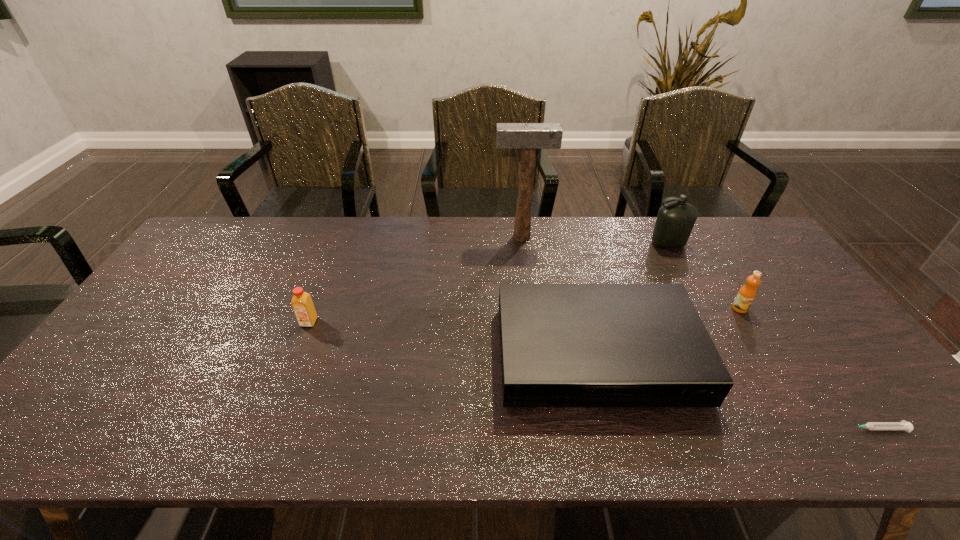
The width and height of the screenshot is (960, 540). Identify the location of vacant space that's between the bottle and the nearer orange juice. (489, 283).

Find the location of `free space between the fourth object from left to right and the farther orange juice`. free space between the fourth object from left to right and the farther orange juice is located at coordinates (704, 276).

Find the location of `vacant space in between the right orange juice and the second tallest object`. vacant space in between the right orange juice and the second tallest object is located at coordinates (704, 276).

Where is `object that can be found as the fourth closest to the right orange juice`? object that can be found as the fourth closest to the right orange juice is located at coordinates (527, 137).

You are a GUI agent. You are given a task and a screenshot of the screen. Output one action in this format:
    pyautogui.click(x=<x>, y=<y>)
    Task: Click on the object that can be found as the fifth closest to the tallest object
    
    Given the screenshot: What is the action you would take?
    pyautogui.click(x=903, y=425)